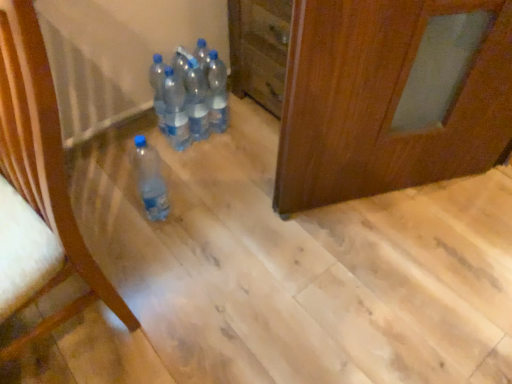
The image size is (512, 384). Find the location of `vacant area that lies between clear plastic bottle at left and translucent plastic bottles at center, placed as the 2th bottle when sorted from right to left`. vacant area that lies between clear plastic bottle at left and translucent plastic bottles at center, placed as the 2th bottle when sorted from right to left is located at coordinates (151, 219).